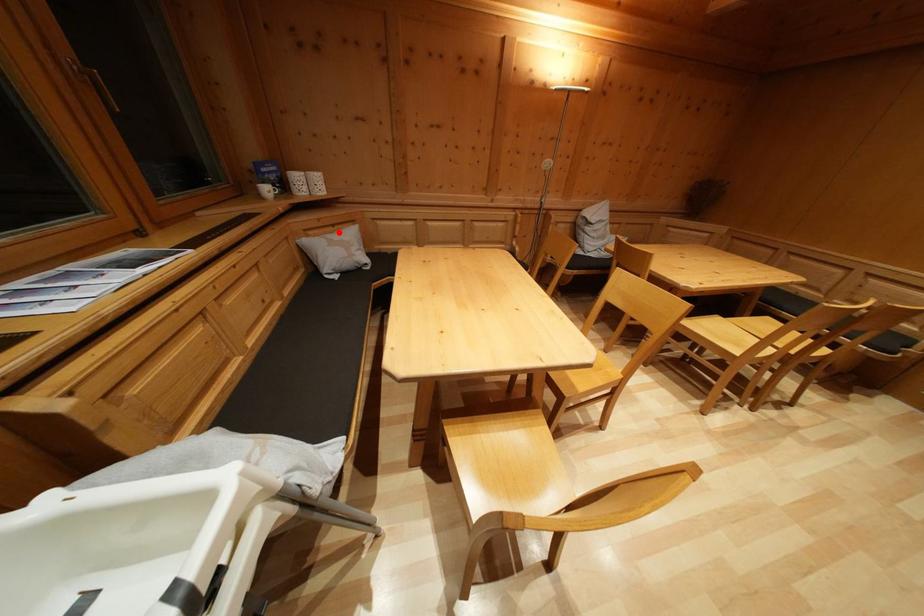
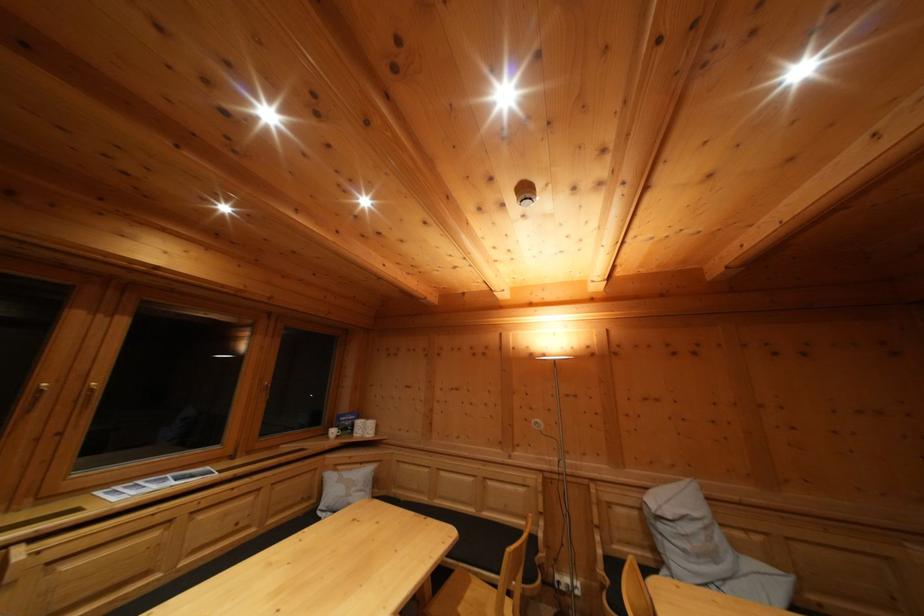
Find the pixel in the second image that matches the highlighted location in the first image.

(368, 469)